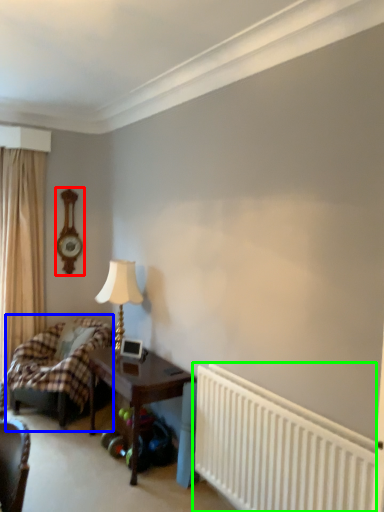
Question: Which is nearer to the clock (highlighted by a red box)? bed (highlighted by a blue box) or radiator (highlighted by a green box).

Choices:
 (A) bed
 (B) radiator

Answer: (A)